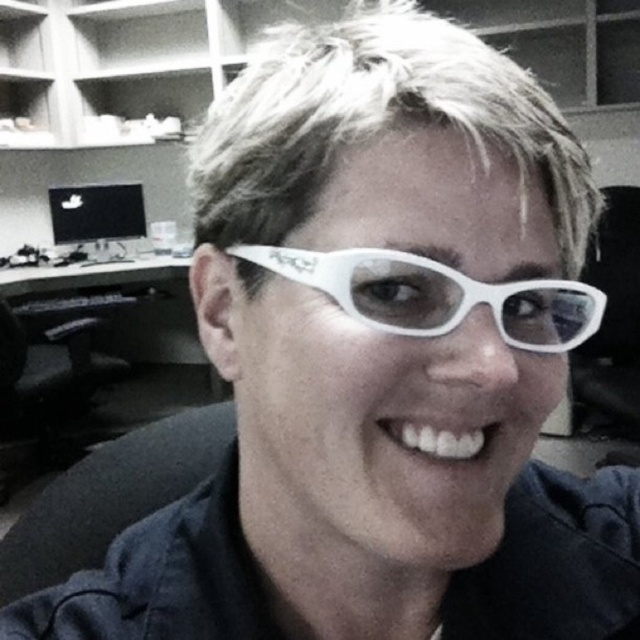
Question: Is white plastic glasses at center behind black glossy monitor at upper left?

Choices:
 (A) no
 (B) yes

Answer: (A)

Question: Which object appears closest to the camera in this image?

Choices:
 (A) black glossy monitor at upper left
 (B) black plastic computer desk at left
 (C) black fabric swivel chair at lower left
 (D) white plastic glasses at center

Answer: (D)

Question: Which object appears closest to the camera in this image?

Choices:
 (A) black fabric swivel chair at lower left
 (B) white plastic glasses at center
 (C) black glossy monitor at upper left
 (D) black plastic computer desk at left

Answer: (B)

Question: Among these objects, which one is farthest from the camera?

Choices:
 (A) black glossy monitor at upper left
 (B) black fabric swivel chair at lower left
 (C) black plastic computer desk at left

Answer: (A)

Question: Is white plastic glasses at center further to the viewer compared to black plastic computer desk at left?

Choices:
 (A) no
 (B) yes

Answer: (A)

Question: Can you confirm if black fabric swivel chair at lower left is positioned above black plastic computer desk at left?

Choices:
 (A) no
 (B) yes

Answer: (A)